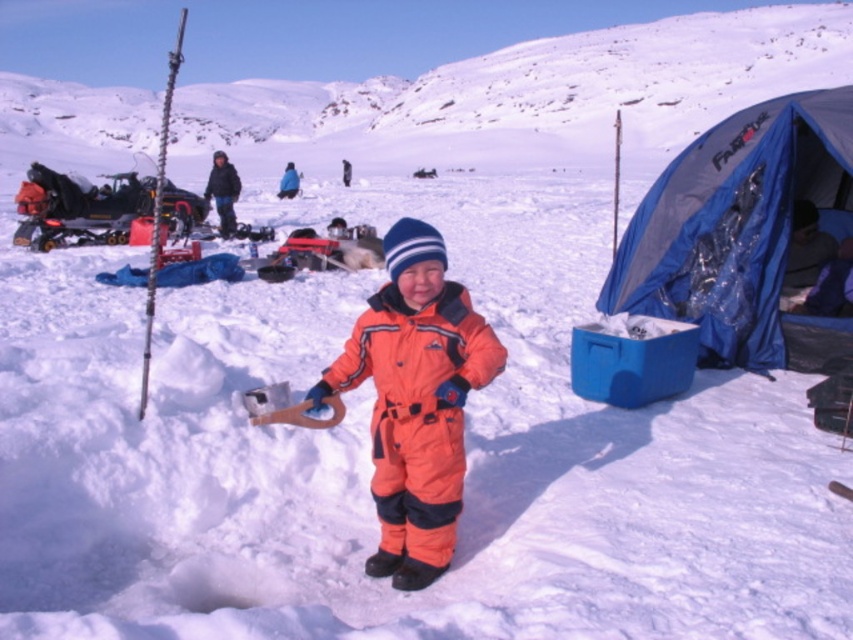
Who is more distant from viewer, (322, 384) or (228, 209)?

The point (228, 209) is behind.

Does point (442, 344) lie behind point (219, 177)?

No, it is not.

You are a GUI agent. You are given a task and a screenshot of the screen. Output one action in this format:
    pyautogui.click(x=<x>, y=<y>)
    Task: Click on the orange softshell snowsuit at center
    
    Given the screenshot: What is the action you would take?
    415,400

Looking at this image, which is below, dark blue jacket at upper center or blue woolen hat at upper center?

dark blue jacket at upper center is below.

Can you confirm if dark blue jacket at upper center is shorter than blue woolen hat at upper center?

In fact, dark blue jacket at upper center may be taller than blue woolen hat at upper center.

I want to click on dark blue jacket at upper center, so click(223, 192).

Does point (756, 172) come in front of point (431, 326)?

That is False.

Is blue fabric tent at right below orange softshell snowsuit at center?

No, blue fabric tent at right is not below orange softshell snowsuit at center.

Between point (752, 291) and point (457, 348), which one is positioned behind?

The point (752, 291) is more distant.

The height and width of the screenshot is (640, 853). I want to click on blue fabric tent at right, so click(x=741, y=234).